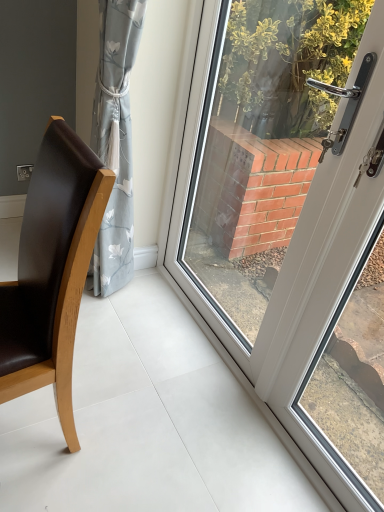
The height and width of the screenshot is (512, 384). I want to click on free space between brown leather chair at left and white glossy door at center, so click(x=167, y=388).